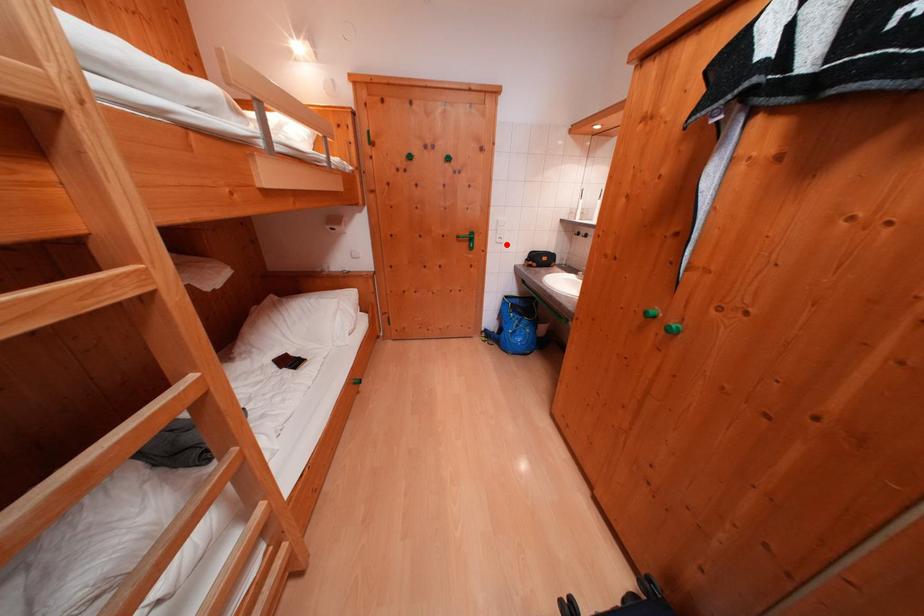
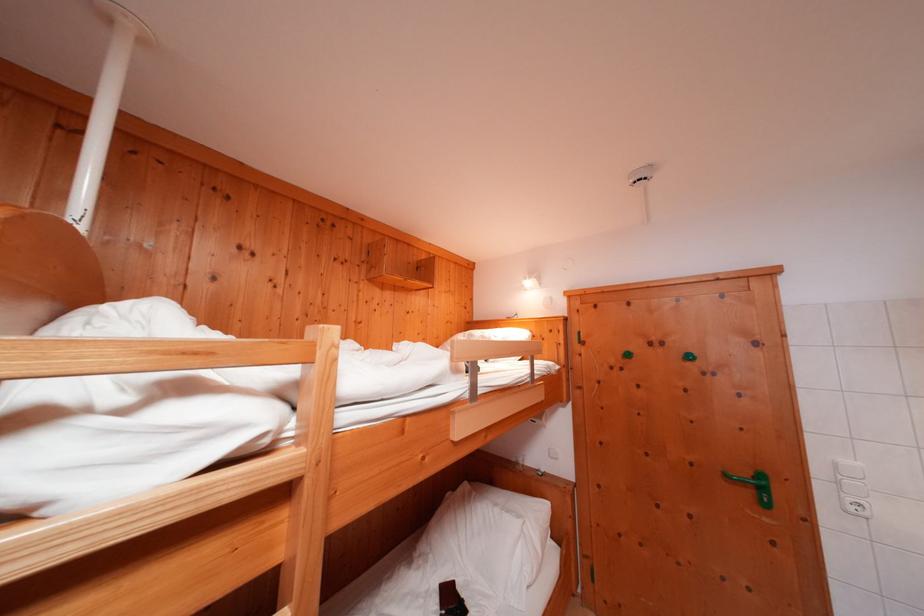
Find the pixel in the second image that matches the highlighted location in the first image.

(858, 513)